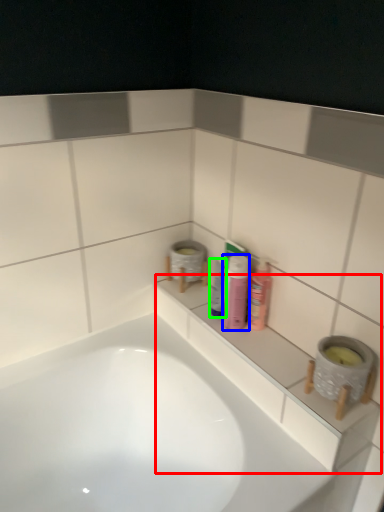
Question: Considering the real-world distances, which object is closest to ledge (highlighted by a red box)? toiletry (highlighted by a blue box) or mouthwash (highlighted by a green box).

Choices:
 (A) toiletry
 (B) mouthwash

Answer: (A)